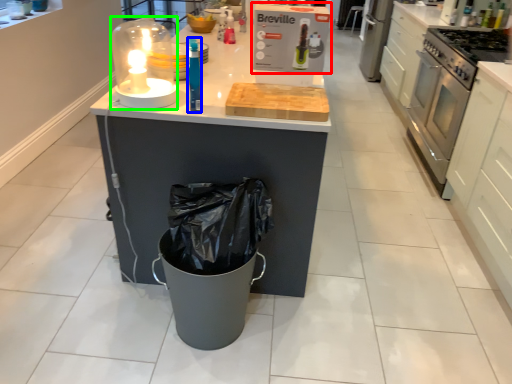
Question: Considering the real-world distances, which object is farthest from kitchen appliance (highlighted by a red box)? bottle (highlighted by a blue box) or candle holder (highlighted by a green box)?

Choices:
 (A) bottle
 (B) candle holder

Answer: (B)